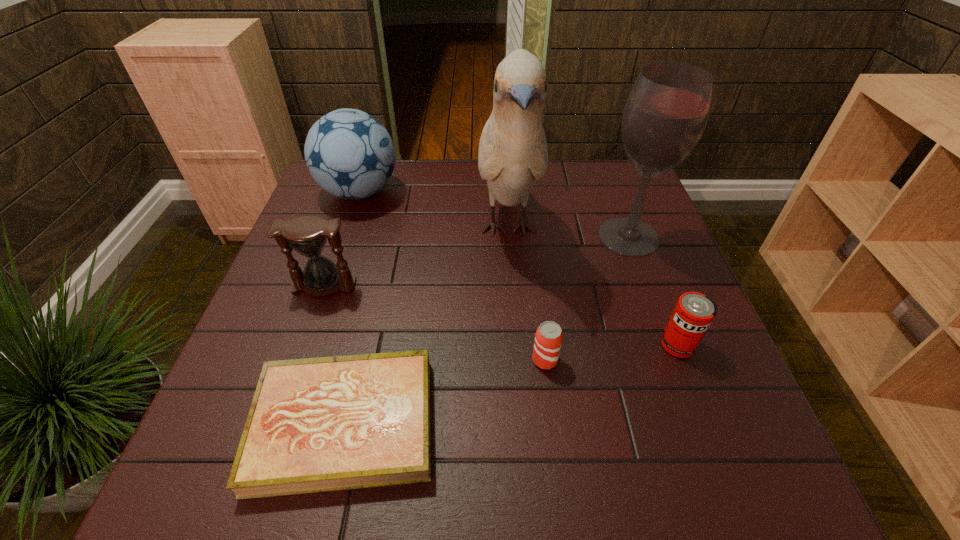
Where is `parakeet`? This screenshot has width=960, height=540. parakeet is located at coordinates (513, 154).

Where is `the second tallest object`? The image size is (960, 540). the second tallest object is located at coordinates (667, 111).

You are a GUI agent. You are given a task and a screenshot of the screen. Output one action in this format:
    pyautogui.click(x=<x>, y=<y>)
    Task: Click on the fifth shortest object
    The width and height of the screenshot is (960, 540).
    Given the screenshot: What is the action you would take?
    pyautogui.click(x=349, y=153)

I want to click on the fourth tallest object, so click(x=307, y=235).

Find the location of `the fifth tallest object`. the fifth tallest object is located at coordinates (694, 312).

Where is `the sixth tallest object`? The width and height of the screenshot is (960, 540). the sixth tallest object is located at coordinates (548, 338).

You are a GUI agent. You are given a task and a screenshot of the screen. Output one action in this format:
    pyautogui.click(x=<x>, y=<y>)
    Task: Click on the hardback book
    The height and width of the screenshot is (540, 960).
    Given the screenshot: What is the action you would take?
    pyautogui.click(x=321, y=424)

The image size is (960, 540). Find the location of `vacant space situated 0.090m on the face of the parakeet`. vacant space situated 0.090m on the face of the parakeet is located at coordinates (515, 317).

Where is `vacant space located 0.240m on the left of the alcohol`? vacant space located 0.240m on the left of the alcohol is located at coordinates click(x=505, y=237).

You are a GUI agent. You are given a task and a screenshot of the screen. Output one action in this format:
    pyautogui.click(x=<x>, y=<y>)
    Task: Click on the vacant area situated on the side with brand of the soccer ball
    The image size is (960, 540).
    Given the screenshot: What is the action you would take?
    point(474,192)